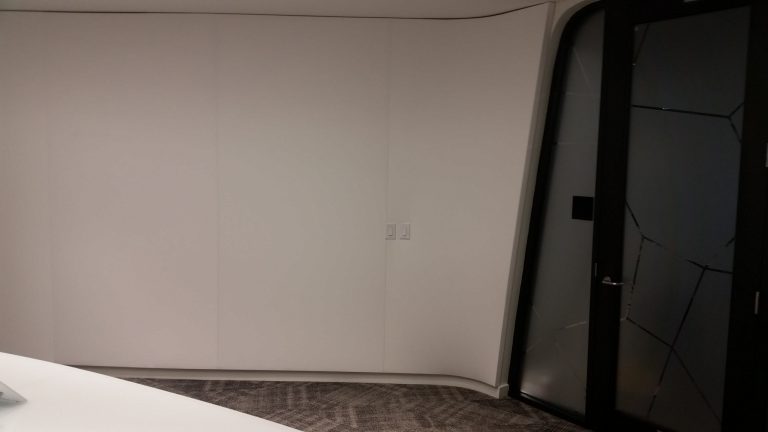
At what (x,y) coordinates should I click in order to perform the action: click on black door jam. Please return your answer as a coordinate pair (x, y). The width and height of the screenshot is (768, 432). Looking at the image, I should click on [584, 15].